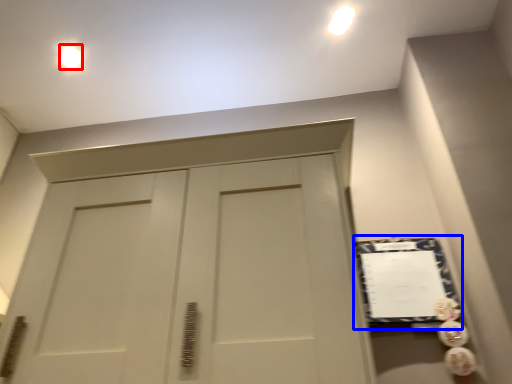
Question: Which of the following is the closest to the observer, lighting (highlighted by a red box) or bulletin board (highlighted by a blue box)?

Choices:
 (A) lighting
 (B) bulletin board

Answer: (B)